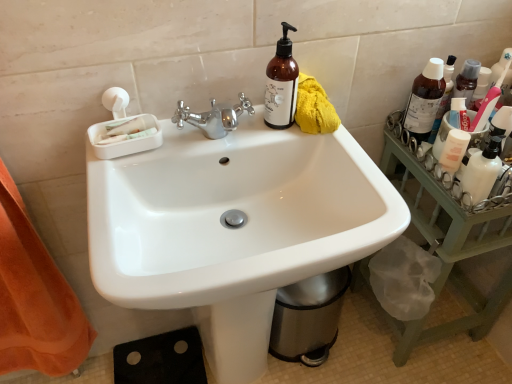
Question: Is white glossy mouthwash at right inside or outside of translucent plastic bottle at upper right, which is the 3th bottle from left to right?

Choices:
 (A) inside
 (B) outside

Answer: (B)

Question: From the image's perspective, is white glossy mouthwash at right located above or below translucent plastic bottle at upper right, acting as the 1th bottle starting from the right?

Choices:
 (A) below
 (B) above

Answer: (A)

Question: Estimate the real-world distances between objects in this image. Which object is closer to the brown glass bottle at upper right, positioned as the third bottle in right-to-left order?

Choices:
 (A) transparent plastic bottle at upper right, acting as the second bottle starting from the left
 (B) white glossy sink at center
 (C) green wood tray at right
 (D) white glossy lotion at right
 (E) translucent plastic bottle at upper right, acting as the 1th bottle starting from the right

Answer: (B)

Question: Which object is positioned closest to the white glossy sink at center?

Choices:
 (A) white glossy lotion at right
 (B) transparent plastic bottle at upper right, acting as the second bottle starting from the left
 (C) translucent plastic bottle at upper right, which is the 3th bottle from left to right
 (D) green wood tray at right
 (E) white glossy mouthwash at right

Answer: (D)